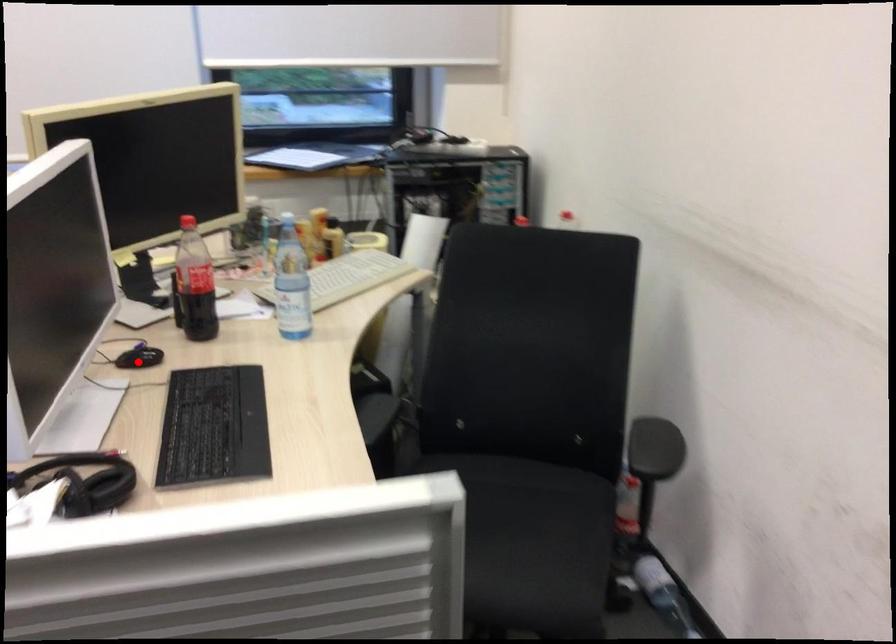
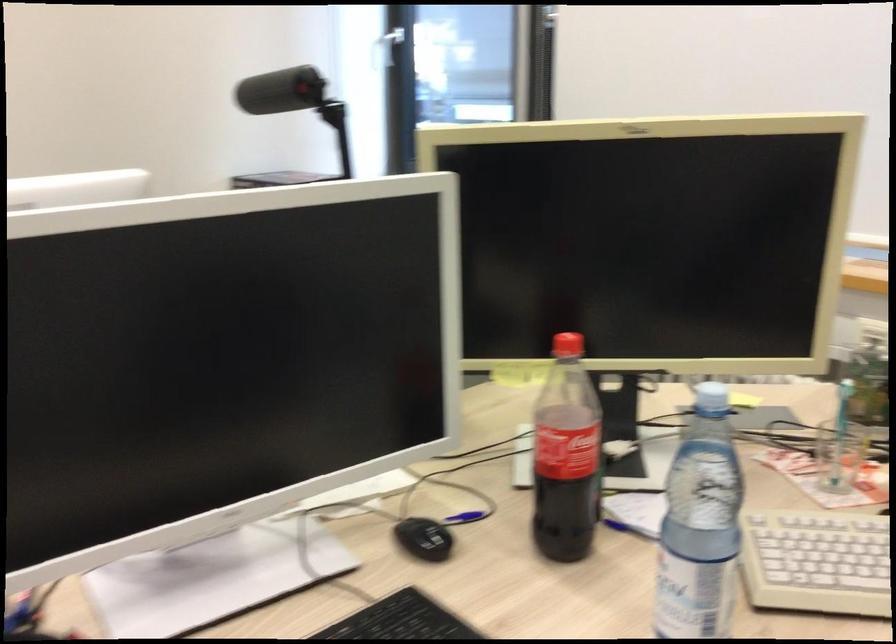
The point at the highlighted location is marked in the first image. Where is the corresponding point in the second image?

(424, 538)